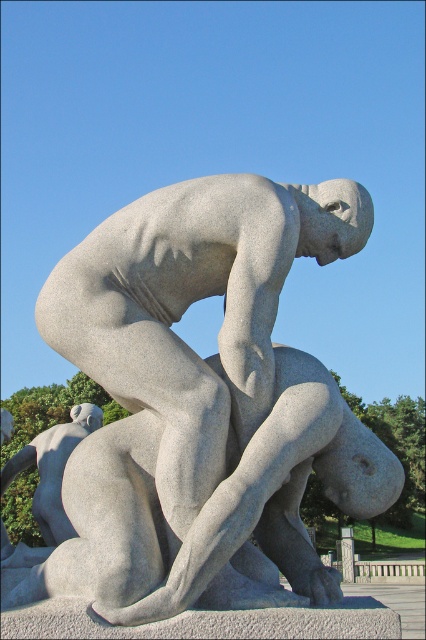
Based on the photo, you are an art conservator examining the gray stone sculpture at center and the gray stone figure at lower left. Based on their positions, which object is located higher in the image?

The gray stone sculpture at center is above the gray stone figure at lower left, so it is located higher in the image.

You are an art curator planning to display the gray stone sculpture at center and the gray stone figure at lower left in a gallery. The gallery has a 2.5 meter wide space. Which object will require a wider space for proper display?

The gray stone figure at lower left requires a wider space because its width is greater than the gray stone sculpture at center, as stated in the description.